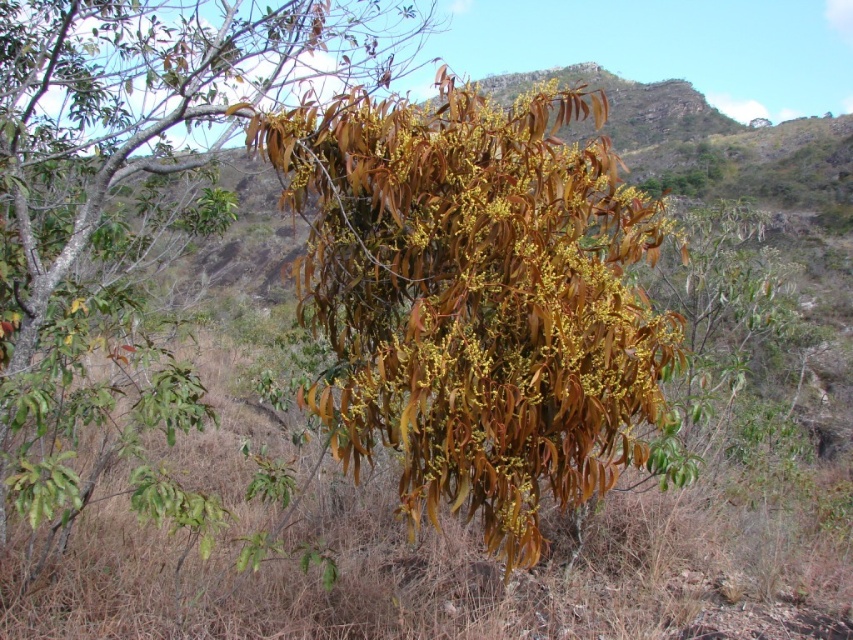
You are an ecologist studying the plant in the image. You observe two sets of leaves labeled as brown leathery leaves at center and leathery brown leaves at center. Which set has a larger size?

The leathery brown leaves at center are larger than the brown leathery leaves at center.

Consider the image. You are standing in the natural landscape described. You notice two sets of leaves labeled as brown leathery leaves at center and leathery brown leaves at center. Which one is closer to you?

Both the brown leathery leaves at center and the leathery brown leaves at center are actually the same plant. The description states they are 3.88 meters away from each other, but since they are part of the same plant, their distance is negligible. Therefore, they are equally close to you.